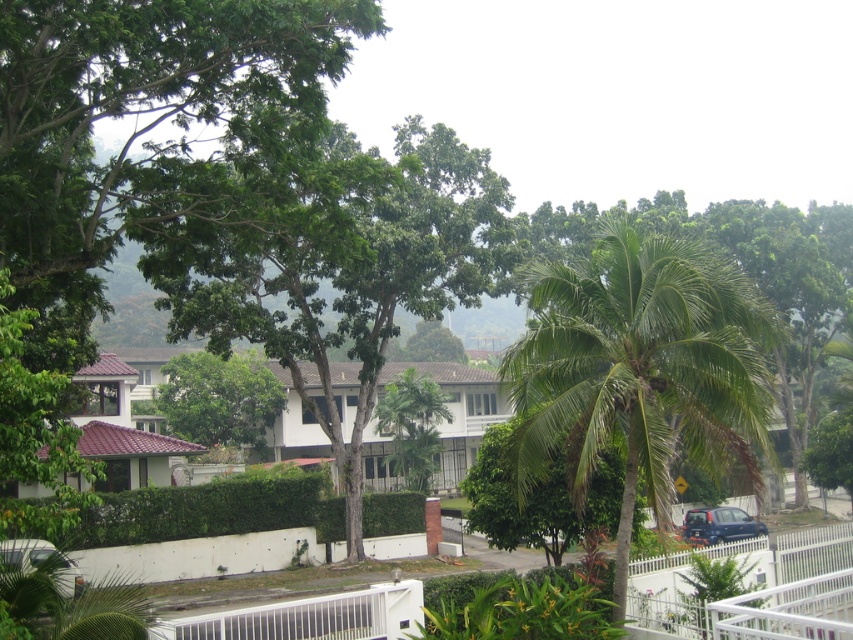
You are standing in the suburban neighborhood scene and want to walk from the white metal rail at lower right to the matte black car at lower left. Which direction should you move?

You should move to the left because the white metal rail at lower right is to the right of the matte black car at lower left.

You are a drone operator tasked with capturing aerial footage of the suburban neighborhood. You need to ensure that the green leafy palm tree at right is centered in the frame. Given that the camera has a field of view that covers coordinates from 0.0 to 1.0 in both x and y axes, what are the coordinates you should aim for to center the tree?

The green leafy palm tree at right is located at coordinates 0.580 in the x axis and 0.750 in the y axis. To center it in the frame, aim for those exact coordinates.